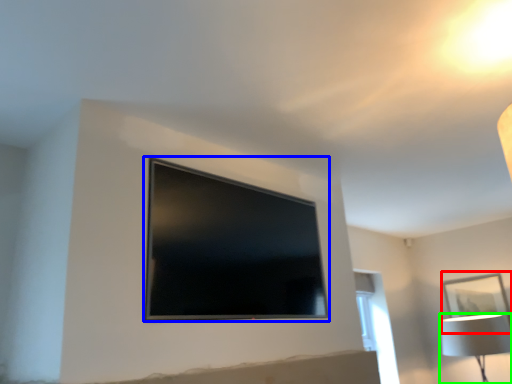
Question: Which object is positioned closest to picture frame (highlighted by a red box)? Select from television (highlighted by a blue box) and lamp (highlighted by a green box).

Choices:
 (A) television
 (B) lamp

Answer: (B)